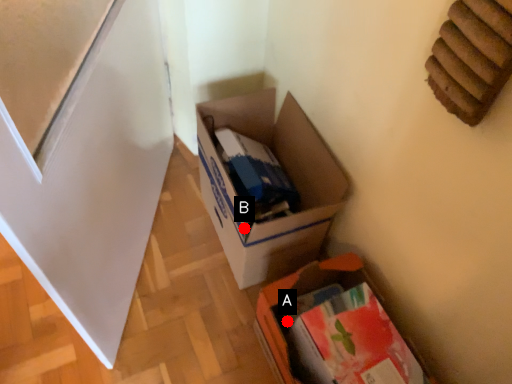
Question: Two points are circled on the image, labeled by A and B beside each circle. Which point is closer to the camera?

Choices:
 (A) A is closer
 (B) B is closer

Answer: (B)